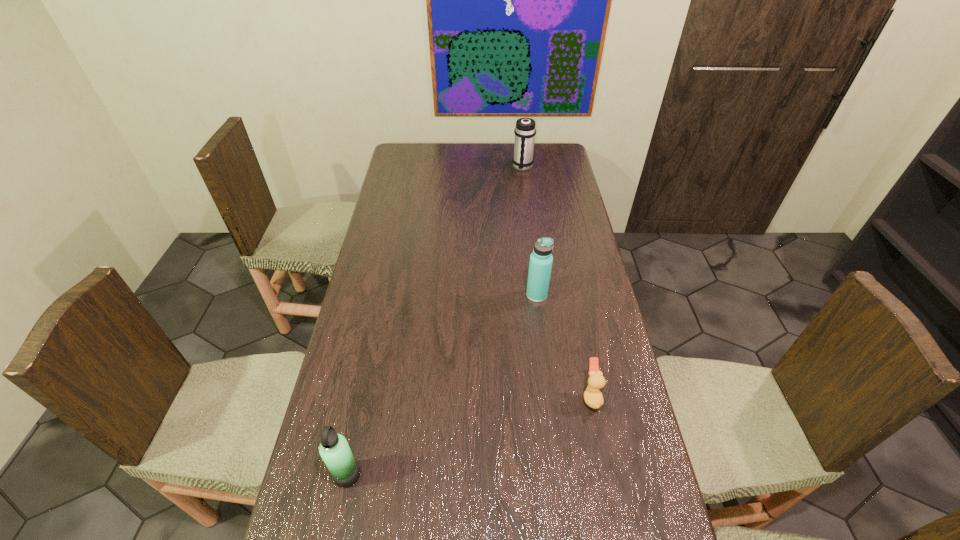
Select which thermos bottle is the closest to the farthest object. Please provide its 2D coordinates. Your answer should be formatted as a tuple, i.e. [(x, y)], where the tuple contains the x and y coordinates of a point satisfying the conditions above.

[(540, 265)]

You are a GUI agent. You are given a task and a screenshot of the screen. Output one action in this format:
    pyautogui.click(x=<x>, y=<y>)
    Task: Click on the second closest thermos bottle to the farthest object
    The height and width of the screenshot is (540, 960).
    Given the screenshot: What is the action you would take?
    pyautogui.click(x=334, y=449)

Identify the location of vacant space that satisfies the following two spatial constraints: 1. on the back side of the second farthest thermos bottle; 2. on the right side of the leftmost object. (385, 295).